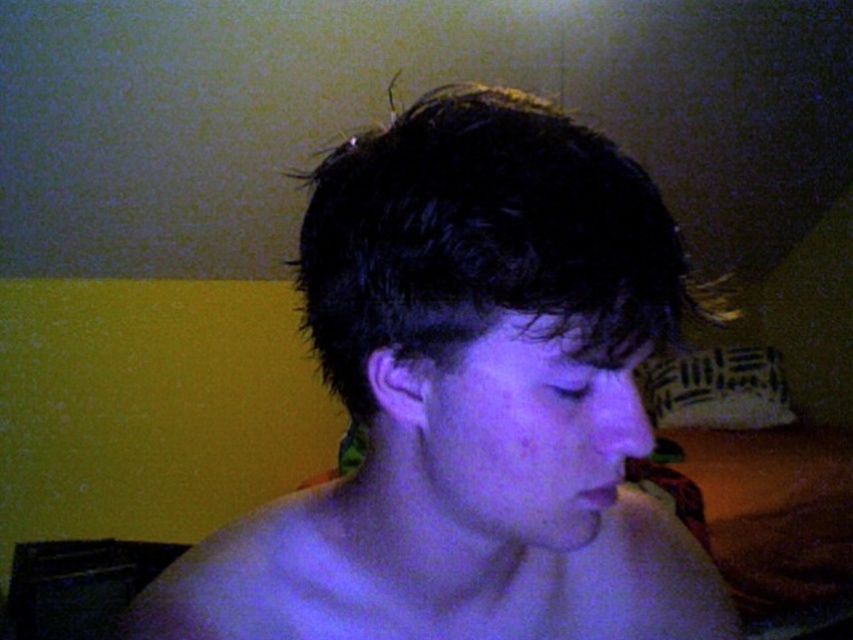
Question: Is dark matte hair at center bigger than smooth skin at center?

Choices:
 (A) yes
 (B) no

Answer: (A)

Question: In this image, where is dark matte hair at center located relative to smooth skin at center?

Choices:
 (A) below
 (B) above

Answer: (B)

Question: Does dark matte hair at center appear over smooth skin at center?

Choices:
 (A) yes
 (B) no

Answer: (A)